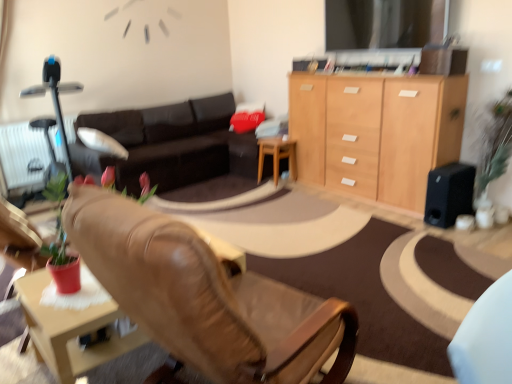
What is the approximate width of white textured radiator at left?

5.05 inches.

The height and width of the screenshot is (384, 512). What do you see at coordinates (449, 193) in the screenshot?
I see `black matte speaker at right` at bounding box center [449, 193].

Locate an element on the screen. This screenshot has height=384, width=512. wooden at center is located at coordinates (277, 156).

The image size is (512, 384). Identify the location of leather chair at center. (205, 297).

Can you see leather chair at center touching wooden at center?

There is a gap between leather chair at center and wooden at center.

Which is in front, leather chair at center or wooden at center?

leather chair at center is in front.

Which of these two, leather chair at center or wooden at center, is smaller?

With smaller size is wooden at center.

Is leather chair at center facing away from wooden at center?

No, wooden at center is not at the back of leather chair at center.

From the image's perspective, which is above, light wood cabinet at upper right or wooden at center?

light wood cabinet at upper right, from the image's perspective.

Does light wood cabinet at upper right have a lesser height compared to wooden at center?

No.

Does light wood cabinet at upper right lie in front of wooden at center?

Yes, light wood cabinet at upper right is closer to the camera.

The height and width of the screenshot is (384, 512). Find the location of `cabinetry above the wooden at center (from a real-world perspective)`. cabinetry above the wooden at center (from a real-world perspective) is located at coordinates (376, 132).

Considering the relative sizes of leather chair at center and light wood cabinet at upper right in the image provided, is leather chair at center bigger than light wood cabinet at upper right?

Incorrect, leather chair at center is not larger than light wood cabinet at upper right.

Visually, is leather chair at center positioned to the left or to the right of light wood cabinet at upper right?

Clearly, leather chair at center is on the left of light wood cabinet at upper right in the image.

I want to click on chair that is below the light wood cabinet at upper right (from the image's perspective), so point(205,297).

Is leather chair at center directly adjacent to light wood cabinet at upper right?

leather chair at center is not next to light wood cabinet at upper right, and they're not touching.

Is point (378, 104) farther from camera compared to point (5, 138)?

No, it is in front of (5, 138).

From the image's perspective, which one is positioned lower, light wood cabinet at upper right or white textured radiator at left?

white textured radiator at left, from the image's perspective.

From the picture: Is light wood cabinet at upper right behind white textured radiator at left?

No, light wood cabinet at upper right is in front of white textured radiator at left.

From a real-world perspective, which object rests below the other?

From a 3D spatial view, white textured radiator at left is below.

Which of these two, white textured radiator at left or wooden at center, is smaller?

With smaller size is wooden at center.

Is wooden at center at the back of white textured radiator at left?

white textured radiator at left is not turned away from wooden at center.

Based on the photo, is the surface of white textured radiator at left in direct contact with wooden at center?

No, white textured radiator at left is not making contact with wooden at center.

Considering the positions of objects white textured radiator at left and wooden at center in the image provided, who is more to the left, white textured radiator at left or wooden at center?

white textured radiator at left is more to the left.

Does leather chair at center have a greater width compared to black matte speaker at right?

Yes, leather chair at center is wider than black matte speaker at right.

Is point (173, 316) less distant than point (430, 211)?

Yes, point (173, 316) is in front of point (430, 211).

Does leather chair at center turn towards black matte speaker at right?

Yes, leather chair at center is facing black matte speaker at right.

From a real-world perspective, is leather chair at center positioned over black matte speaker at right based on gravity?

Correct, in the physical world, leather chair at center is higher than black matte speaker at right.

How many degrees apart are the facing directions of black matte speaker at right and light wood cabinet at upper right?

1.18 degrees.

Between black matte speaker at right and light wood cabinet at upper right, which one has more height?

With more height is light wood cabinet at upper right.

Does black matte speaker at right have a larger size compared to light wood cabinet at upper right?

Incorrect, black matte speaker at right is not larger than light wood cabinet at upper right.

Image resolution: width=512 pixels, height=384 pixels. Find the location of `speaker on the right of light wood cabinet at upper right`. speaker on the right of light wood cabinet at upper right is located at coordinates (449, 193).

The image size is (512, 384). In order to click on chair above the wooden at center (from a real-world perspective) in this screenshot , I will do `click(205, 297)`.

Image resolution: width=512 pixels, height=384 pixels. I want to click on desk that appears below the light wood cabinet at upper right (from the image's perspective), so [277, 156].

Considering their positions, is dark brown leather couch at center positioned further to leather chair at center than black matte speaker at right?

dark brown leather couch at center is positioned further to the anchor leather chair at center.

Looking at the image, which one is located closer to wooden at center, dark brown leather couch at center or black matte speaker at right?

dark brown leather couch at center.

Which object lies further to the anchor point leather chair at center, wooden at center or white textured radiator at left?

Based on the image, white textured radiator at left appears to be further to leather chair at center.

Looking at the image, which one is located further to wooden at center, white textured radiator at left or leather chair at center?

The object further to wooden at center is leather chair at center.

Which object lies nearer to the anchor point black matte speaker at right, leather chair at center or light wood cabinet at upper right?

light wood cabinet at upper right is positioned closer to the anchor black matte speaker at right.

Which object lies nearer to the anchor point black matte speaker at right, light wood cabinet at upper right or white textured radiator at left?

light wood cabinet at upper right is positioned closer to the anchor black matte speaker at right.

When comparing their distances from leather chair at center, does wooden at center or light wood cabinet at upper right seem further?

wooden at center.

Estimate the real-world distances between objects in this image. Which object is further from light wood cabinet at upper right, dark brown leather couch at center or white textured radiator at left?

Among the two, white textured radiator at left is located further to light wood cabinet at upper right.

Locate an element on the screen. Image resolution: width=512 pixels, height=384 pixels. studio couch between white textured radiator at left and black matte speaker at right is located at coordinates pyautogui.click(x=175, y=149).

You are a GUI agent. You are given a task and a screenshot of the screen. Output one action in this format:
    pyautogui.click(x=<x>, y=<y>)
    Task: Click on the cabinetry between leather chair at center and black matte speaker at right from front to back
    
    Given the screenshot: What is the action you would take?
    pyautogui.click(x=376, y=132)

Identify the location of cabinetry between leather chair at center and wooden at center along the z-axis. (376, 132).

Image resolution: width=512 pixels, height=384 pixels. What are the coordinates of `studio couch positioned between leather chair at center and wooden at center from near to far` in the screenshot? It's located at (175, 149).